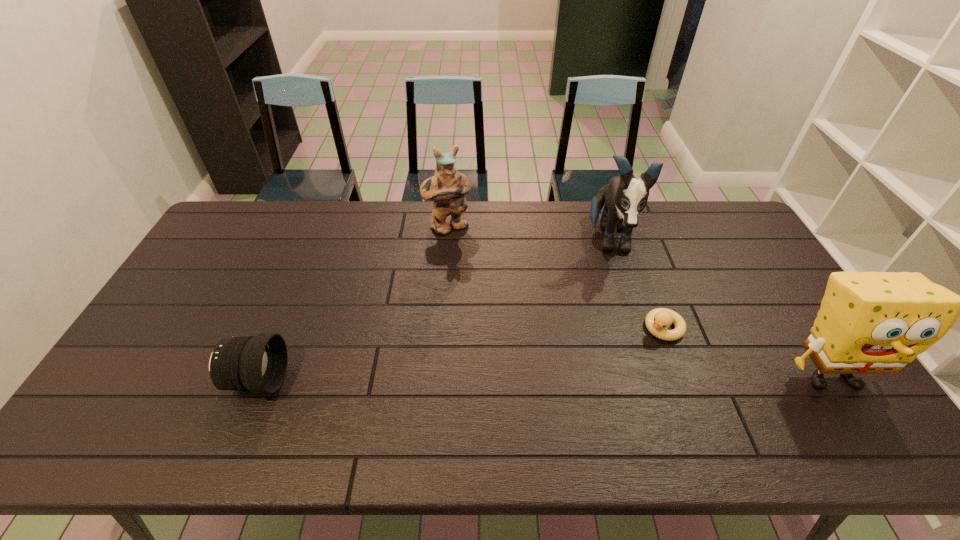
You are a GUI agent. You are given a task and a screenshot of the screen. Output one action in this format:
    pyautogui.click(x=<x>, y=<y>)
    Task: Click on the free space that is in between the tallest object and the shortest object
    
    Given the screenshot: What is the action you would take?
    pyautogui.click(x=636, y=284)

Find the location of a particular element. This screenshot has width=960, height=540. free space between the leftmost object and the rightmost object is located at coordinates (544, 379).

In order to click on vacant area that lies between the rightmost object and the telephoto lens in this screenshot , I will do `click(544, 379)`.

Image resolution: width=960 pixels, height=540 pixels. Find the location of `free space between the sponge and the fourth object from right to left`. free space between the sponge and the fourth object from right to left is located at coordinates (639, 301).

What are the coordinates of `vacant area that lies between the leftmost object and the figurine` in the screenshot? It's located at (352, 303).

Image resolution: width=960 pixels, height=540 pixels. In order to click on free space between the leftmost object and the figurine in this screenshot , I will do `click(352, 303)`.

Image resolution: width=960 pixels, height=540 pixels. I want to click on free space between the figurine and the rightmost object, so click(x=639, y=301).

The width and height of the screenshot is (960, 540). In order to click on free spot between the rightmost object and the puppy in this screenshot , I will do `click(720, 309)`.

This screenshot has width=960, height=540. Identify the location of the second closest object to the tallest object. (869, 322).

Find the location of a particular element. object that is the closest to the puppy is located at coordinates (657, 320).